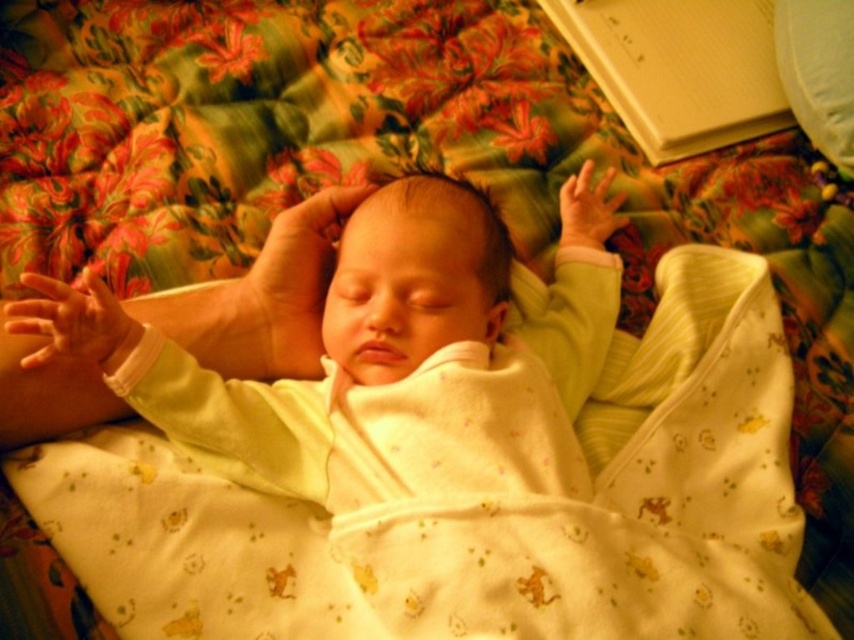
What do you see at coordinates (385, 349) in the screenshot?
I see `soft yellow fabric baby at center` at bounding box center [385, 349].

Is soft yellow fabric baby at center shorter than white soft pillow at upper right?

In fact, soft yellow fabric baby at center may be taller than white soft pillow at upper right.

Is point (142, 387) closer to camera compared to point (819, 26)?

Yes, it is.

Where is `soft yellow fabric baby at center`? The image size is (854, 640). soft yellow fabric baby at center is located at coordinates (385, 349).